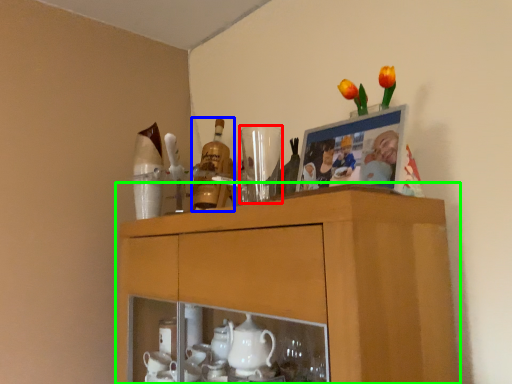
Question: Estimate the real-world distances between objects in this image. Which object is closer to tableware (highlighted by a red box), bottle (highlighted by a blue box) or cabinetry (highlighted by a green box)?

Choices:
 (A) bottle
 (B) cabinetry

Answer: (A)